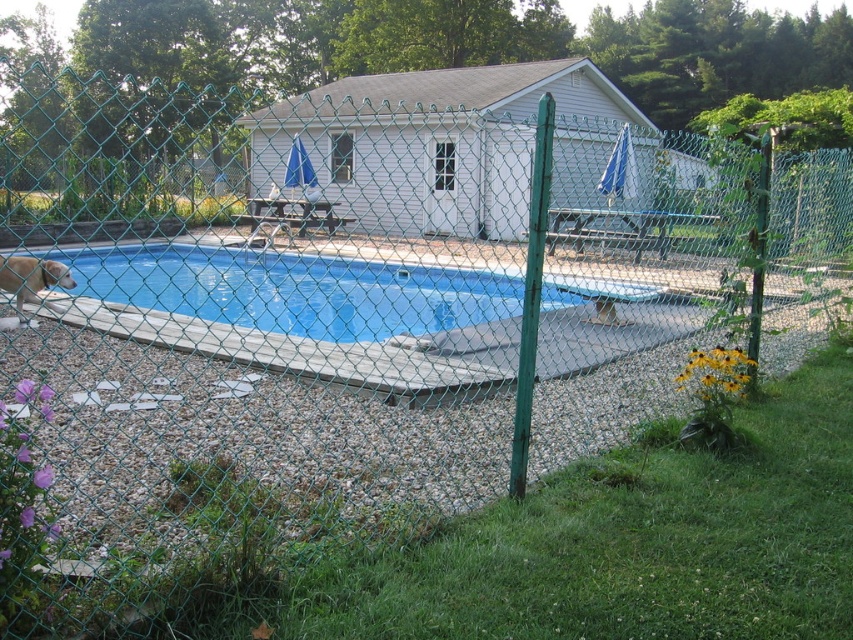
Can you confirm if blue vinyl liner at left is positioned above light brown fur at lower left?

Correct, blue vinyl liner at left is located above light brown fur at lower left.

Does blue vinyl liner at left have a lesser height compared to light brown fur at lower left?

Yes, blue vinyl liner at left is shorter than light brown fur at lower left.

Which is behind, point (235, 252) or point (70, 285)?

The point (235, 252) is more distant.

The image size is (853, 640). What are the coordinates of `blue vinyl liner at left` in the screenshot? It's located at (293, 289).